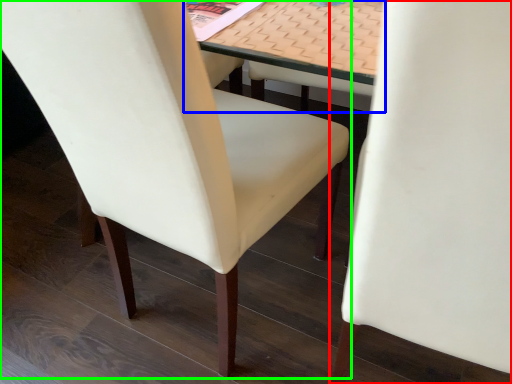
Question: Based on their relative distances, which object is nearer to chair (highlighted by a red box)? Choose from table (highlighted by a blue box) and chair (highlighted by a green box).

Choices:
 (A) table
 (B) chair

Answer: (A)